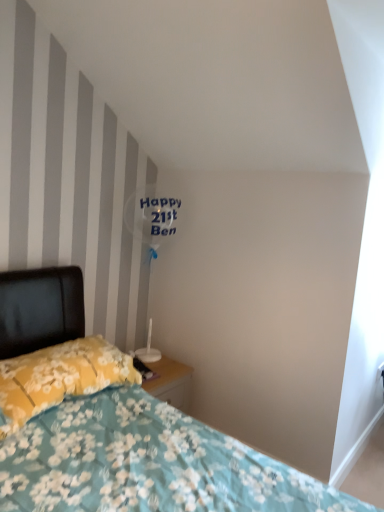
Question: From the image's perspective, is floral fabric bed at lower left above or below yellow floral fabric pillow at lower left?

Choices:
 (A) below
 (B) above

Answer: (A)

Question: Is point (168, 459) closer or farther from the camera than point (16, 399)?

Choices:
 (A) farther
 (B) closer

Answer: (B)

Question: Is floral fabric bed at lower left in front of or behind yellow floral fabric pillow at lower left in the image?

Choices:
 (A) behind
 (B) front

Answer: (B)

Question: In terms of size, does yellow floral fabric pillow at lower left appear bigger or smaller than floral fabric bed at lower left?

Choices:
 (A) big
 (B) small

Answer: (B)

Question: From a real-world perspective, relative to floral fabric bed at lower left, is yellow floral fabric pillow at lower left vertically above or below?

Choices:
 (A) below
 (B) above

Answer: (A)

Question: Looking at their shapes, would you say yellow floral fabric pillow at lower left is wider or thinner than floral fabric bed at lower left?

Choices:
 (A) wide
 (B) thin

Answer: (B)

Question: Would you say yellow floral fabric pillow at lower left is to the left or to the right of floral fabric bed at lower left in the picture?

Choices:
 (A) right
 (B) left

Answer: (B)